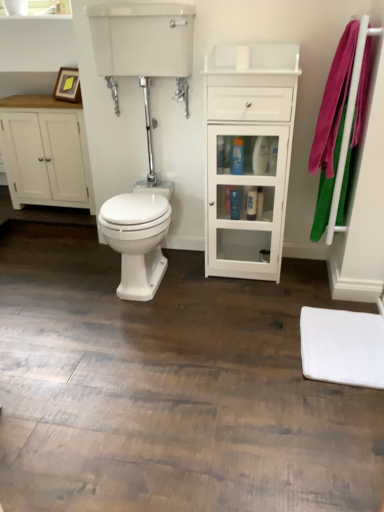
This screenshot has height=512, width=384. What do you see at coordinates (137, 241) in the screenshot?
I see `white glossy bidet at center` at bounding box center [137, 241].

In order to face translucent plastic bottle at center, which is the 1th toiletry from back to front, should I rotate leftwards or rightwards?

It's best to rotate right around 5.686 degrees.

The image size is (384, 512). I want to click on white matte cabinet at left, so click(45, 152).

From the picture: From the image's perspective, which is above, pink fabric bath towel at right or white glossy bidet at center?

pink fabric bath towel at right appears higher in the image.

Based on the photo, which of these two, pink fabric bath towel at right or white glossy bidet at center, stands taller?

Standing taller between the two is pink fabric bath towel at right.

From a real-world perspective, is pink fabric bath towel at right above or below white glossy bidet at center?

Clearly, from a real-world perspective, pink fabric bath towel at right is above white glossy bidet at center.

Is translucent plastic bottle at center, which is the 1th toiletry from back to front, not near white glossy cabinet at center?

Actually, translucent plastic bottle at center, which is the 1th toiletry from back to front, and white glossy cabinet at center are a little close together.

From the image's perspective, is translucent plastic bottle at center, which is the 1th toiletry from back to front, beneath white glossy cabinet at center?

Yes, from the image's perspective, translucent plastic bottle at center, which is the 1th toiletry from back to front, is below white glossy cabinet at center.

Is translucent plastic bottle at center, which is the 1th toiletry from back to front, taller or shorter than white glossy cabinet at center?

In the image, translucent plastic bottle at center, which is the 1th toiletry from back to front, appears to be shorter than white glossy cabinet at center.

Based on the photo, can you tell me how much translucent plastic bottle at center, which appears as the second toiletry when viewed from the top, and white glossy cabinet at center differ in facing direction?

0.00187 degrees separate the facing orientations of translucent plastic bottle at center, which appears as the second toiletry when viewed from the top, and white glossy cabinet at center.

From the image's perspective, is pink fabric bath towel at right on top of white glossy cabinet at center?

Yes, from the image's perspective, pink fabric bath towel at right is on top of white glossy cabinet at center.

You are a GUI agent. You are given a task and a screenshot of the screen. Output one action in this format:
    pyautogui.click(x=<x>, y=<y>)
    Task: Click on the bath towel on the right of white glossy cabinet at center
    This screenshot has width=384, height=512.
    Given the screenshot: What is the action you would take?
    pyautogui.click(x=332, y=126)

Is pink fabric bath towel at right smaller than white glossy cabinet at center?

Correct, pink fabric bath towel at right occupies less space than white glossy cabinet at center.

From a real-world perspective, is white matte cabinet at left physically located above or below wooden picture frame at upper left?

white matte cabinet at left is below wooden picture frame at upper left.

Between white matte cabinet at left and wooden picture frame at upper left, which one is positioned in front?

wooden picture frame at upper left.

From the image's perspective, which is below, white matte cabinet at left or wooden picture frame at upper left?

white matte cabinet at left appears lower in the image.

Where is `bathroom cabinet to the left of wooden picture frame at upper left`? Image resolution: width=384 pixels, height=512 pixels. bathroom cabinet to the left of wooden picture frame at upper left is located at coordinates [45, 152].

There is a wooden picture frame at upper left. Where is `the 1st toiletry below it (from a real-world perspective)`? the 1st toiletry below it (from a real-world perspective) is located at coordinates (237, 156).

Would you say blue glossy bottle at center, the second toiletry positioned from the back, is to the left or to the right of wooden picture frame at upper left in the picture?

In the image, blue glossy bottle at center, the second toiletry positioned from the back, appears on the right side of wooden picture frame at upper left.

From a real-world perspective, relative to wooden picture frame at upper left, is blue glossy bottle at center, the second toiletry positioned from the back, vertically above or below?

Clearly, from a real-world perspective, blue glossy bottle at center, the second toiletry positioned from the back, is below wooden picture frame at upper left.

Between blue glossy bottle at center, positioned as the 1th toiletry in front-to-back order, and wooden picture frame at upper left, which one has smaller size?

blue glossy bottle at center, positioned as the 1th toiletry in front-to-back order, is smaller.

Can you see white glossy tank at upper center touching blue glossy bottle at center, the second toiletry positioned from the back?

No, white glossy tank at upper center is not in contact with blue glossy bottle at center, the second toiletry positioned from the back.

From a real-world perspective, is white glossy tank at upper center positioned over blue glossy bottle at center, positioned as the 1th toiletry in front-to-back order, based on gravity?

Indeed, from a real-world perspective, white glossy tank at upper center stands above blue glossy bottle at center, positioned as the 1th toiletry in front-to-back order.

Which object is positioned more to the left, white glossy tank at upper center or blue glossy bottle at center, the second toiletry in the bottom-to-top sequence?

From the viewer's perspective, white glossy tank at upper center appears more on the left side.

In the image, is white glossy tank at upper center positioned in front of or behind blue glossy bottle at center, the second toiletry in the bottom-to-top sequence?

Clearly, white glossy tank at upper center is in front of blue glossy bottle at center, the second toiletry in the bottom-to-top sequence.

Between white glossy cabinet at center and white glossy bidet at center, which one has less height?

Standing shorter between the two is white glossy bidet at center.

From a real-world perspective, which object rests below the other?

white glossy bidet at center.

From the image's perspective, which one is positioned lower, white glossy cabinet at center or white glossy bidet at center?

white glossy bidet at center.

Is white glossy cabinet at center positioned far away from white glossy bidet at center?

white glossy cabinet at center is actually quite close to white glossy bidet at center.

The width and height of the screenshot is (384, 512). In order to click on bath towel in front of the white glossy bidet at center in this screenshot , I will do `click(332, 126)`.

In the image, there is a white glossy cabinet at center. Where is `toiletry below it (from a real-world perspective)`? The height and width of the screenshot is (512, 384). toiletry below it (from a real-world perspective) is located at coordinates (235, 202).

Which object lies nearer to the anchor point white matte cabinet at left, blue glossy bottle at center, the first toiletry when ordered from top to bottom, or wooden picture frame at upper left?

wooden picture frame at upper left is positioned closer to the anchor white matte cabinet at left.

Consider the image. Estimate the real-world distances between objects in this image. Which object is closer to white matte cabinet at left, white glossy cabinet at center or white glossy bidet at center?

Among the two, white glossy bidet at center is located nearer to white matte cabinet at left.

When comparing their distances from wooden picture frame at upper left, does white matte mat at lower right or white matte cabinet at left seem closer?

white matte cabinet at left is closer to wooden picture frame at upper left.

Based on their spatial positions, is translucent plastic bottle at center, the first toiletry from the bottom, or white glossy cabinet at center further from white matte mat at lower right?

translucent plastic bottle at center, the first toiletry from the bottom, is further to white matte mat at lower right.

Which object lies nearer to the anchor point white glossy bidet at center, translucent plastic bottle at center, which appears as the second toiletry when viewed from the top, or white glossy cabinet at center?

The object closer to white glossy bidet at center is white glossy cabinet at center.

Estimate the real-world distances between objects in this image. Which object is further from white glossy cabinet at center, blue glossy bottle at center, positioned as the 1th toiletry in front-to-back order, or white glossy bidet at center?

white glossy bidet at center lies further to white glossy cabinet at center than the other object.

Considering their positions, is blue glossy bottle at center, the second toiletry in the bottom-to-top sequence, positioned closer to white glossy bidet at center than white matte cabinet at left?

blue glossy bottle at center, the second toiletry in the bottom-to-top sequence, is positioned closer to the anchor white glossy bidet at center.

Which object lies further to the anchor point white glossy cabinet at center, white matte mat at lower right or translucent plastic bottle at center, which appears as the second toiletry when viewed from the top?

white matte mat at lower right is further to white glossy cabinet at center.

Find the location of a particular element. cabinetry between white glossy tank at upper center and translucent plastic bottle at center, which is the 1th toiletry from back to front, in the up-down direction is located at coordinates (248, 156).

Find the location of a particular element. This screenshot has width=384, height=512. sink between white matte cabinet at left and white glossy cabinet at center from left to right is located at coordinates tap(142, 39).

The height and width of the screenshot is (512, 384). In order to click on bidet between white matte cabinet at left and white glossy cabinet at center in this screenshot , I will do [137, 241].

Identify the location of sink situated between wooden picture frame at upper left and white glossy cabinet at center from left to right. The width and height of the screenshot is (384, 512). (142, 39).